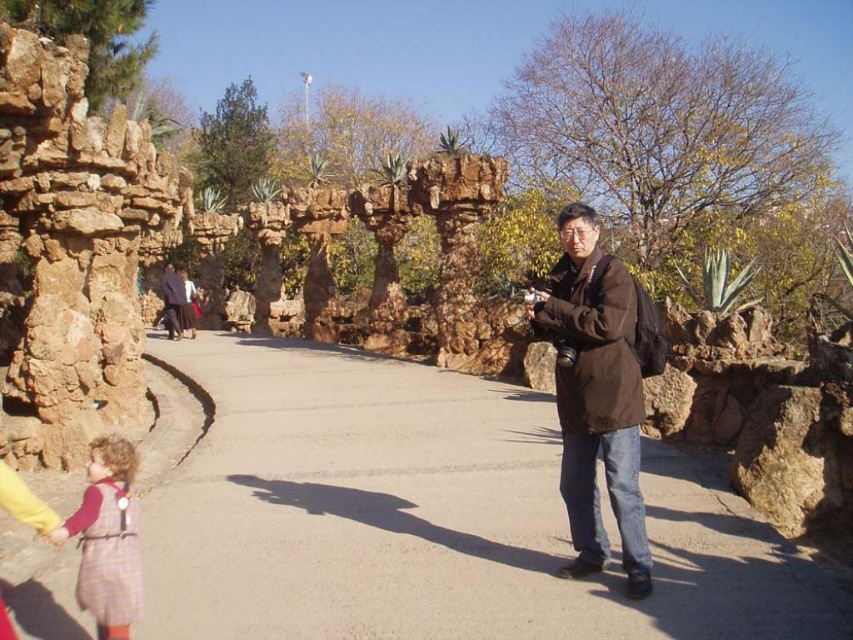
You are standing on the concrete pavement at center and want to walk towards the brown rough stone at left. Which direction should you head?

Since the concrete pavement at center is closer to the viewer than the brown rough stone at left, you should head towards the left to reach the brown rough stone at left.

You are planning to walk from the concrete pavement at center to the brown rough stone at left. Which object will you encounter first?

The concrete pavement at center is smaller than the brown rough stone at left, so you will encounter the concrete pavement at center first because it is closer to your starting point.